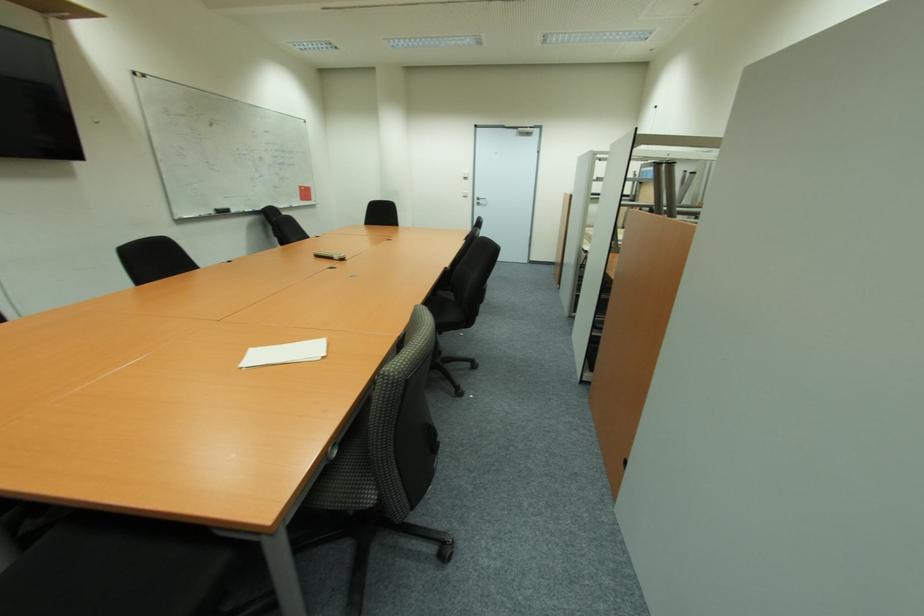
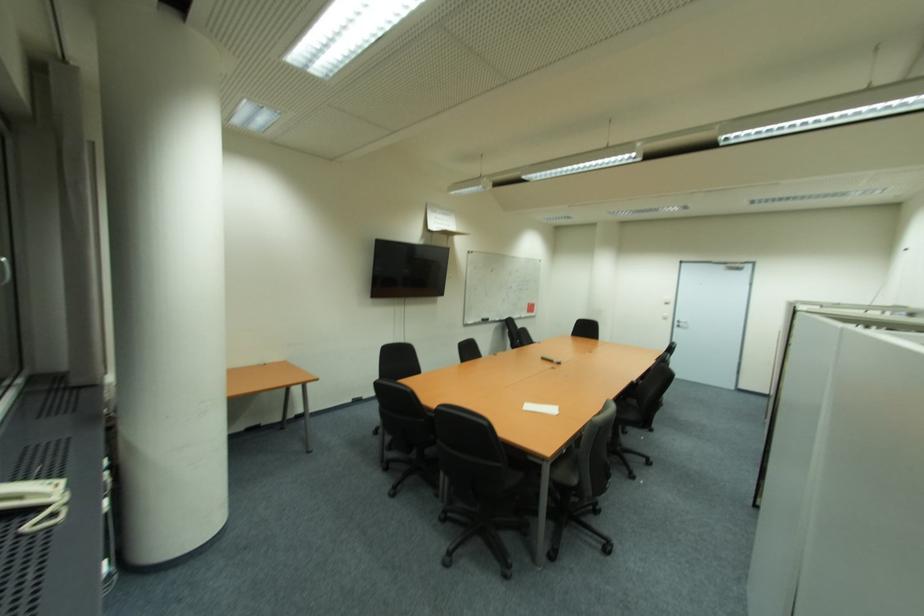
The point at (x=483, y=203) is marked in the first image. Where is the corresponding point in the second image?

(686, 325)